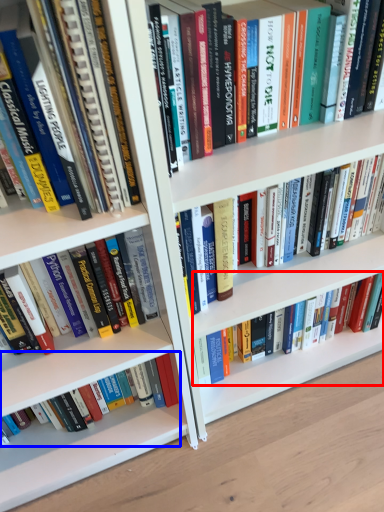
Question: Which point is further to the camera, book (highlighted by a red box) or book (highlighted by a blue box)?

Choices:
 (A) book
 (B) book

Answer: (A)